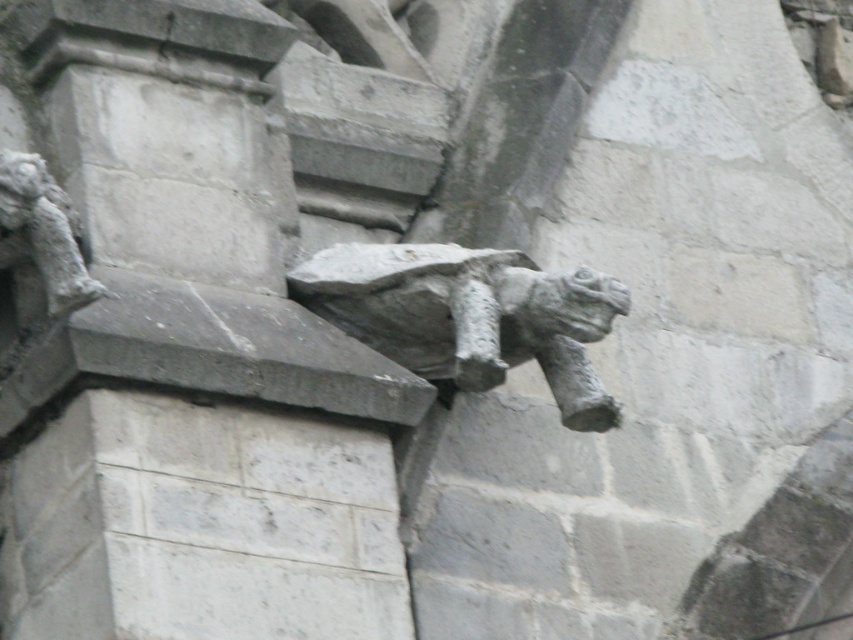
Is gray stone gargoyle at upper center thinner than gray stone gargoyle at upper left?

Yes.

Which of these two, gray stone gargoyle at upper center or gray stone gargoyle at upper left, stands shorter?

gray stone gargoyle at upper center

Locate an element on the screen. gray stone gargoyle at upper center is located at coordinates (469, 316).

Locate an element on the screen. gray stone gargoyle at upper center is located at coordinates [469, 316].